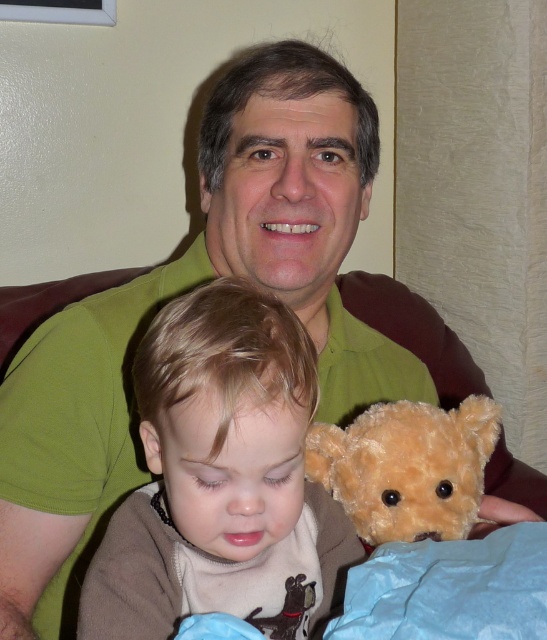
You are a photographer trying to capture a closeup of both the soft brown teddy bear at center and the fuzzy brown teddy bear at center in the image. Given that your camera can focus on objects within a 5 inch range, will you be able to capture both bears clearly in the same shot?

The distance between the soft brown teddy bear at center and fuzzy brown teddy bear at center is 5.61 inches. Since your camera can focus within a 5 inch range, the teddy bears are slightly beyond the focus range. You may need to adjust your position or use a different lens to ensure both are in focus.